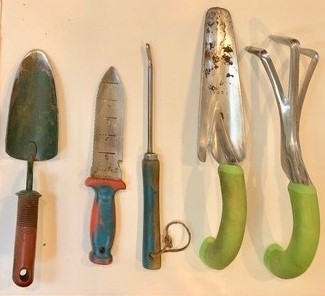
The width and height of the screenshot is (325, 296). I want to click on handle, so [296, 256].